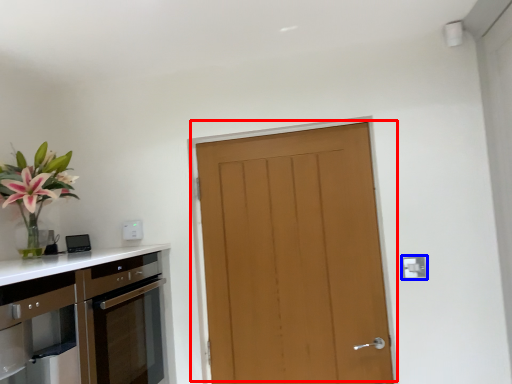
Question: Among these objects, which one is nearest to the camera, door (highlighted by a red box) or electric outlet (highlighted by a blue box)?

Choices:
 (A) door
 (B) electric outlet

Answer: (B)